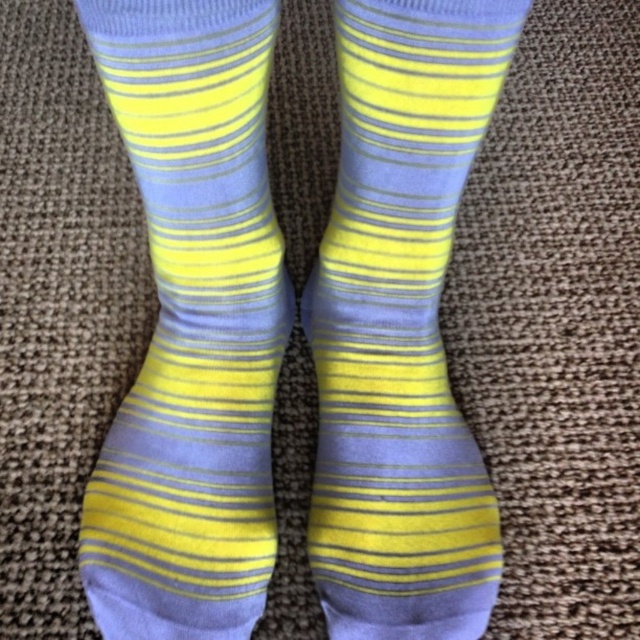
Can you confirm if matte yellow-blue striped sock at center is positioned below yellow striped sock at center?

Yes.

Which is in front, point (250, 200) or point (484, 513)?

Point (250, 200)

Locate an element on the screen. matte yellow-blue striped sock at center is located at coordinates (192, 326).